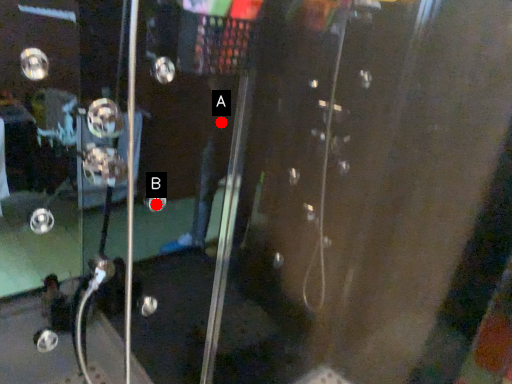
Question: Two points are circled on the image, labeled by A and B beside each circle. Which point appears closest to the camera in this image?

Choices:
 (A) A is closer
 (B) B is closer

Answer: (B)